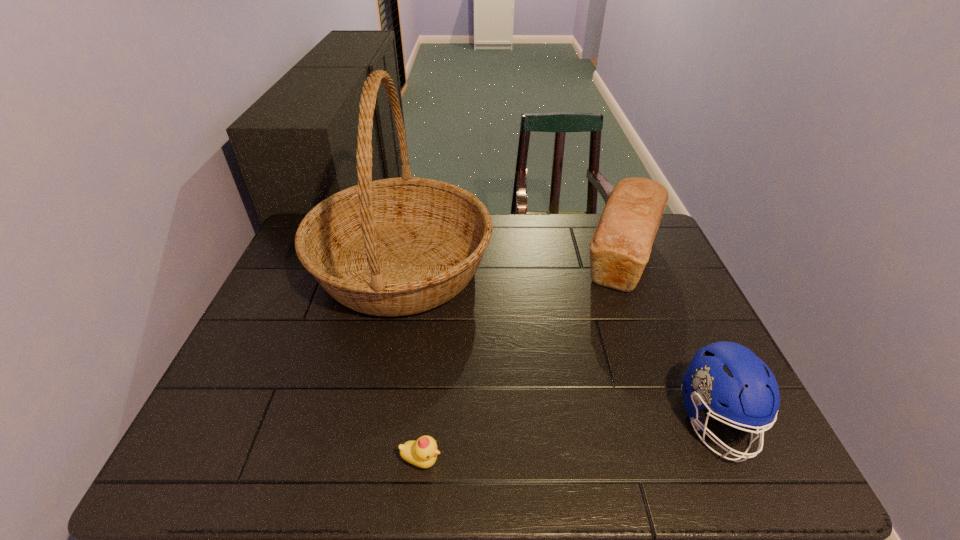
Find the location of a particular element. vacant space at the right edge of the desktop is located at coordinates (706, 342).

Locate an element on the screen. The image size is (960, 540). free space at the far left corner of the desktop is located at coordinates (297, 255).

Image resolution: width=960 pixels, height=540 pixels. I want to click on vacant space at the far right corner, so click(x=666, y=246).

Find the location of a particular element. The height and width of the screenshot is (540, 960). empty space between the third tallest object and the bread is located at coordinates (669, 340).

Find the location of a particular element. free space between the third tallest object and the bread is located at coordinates (669, 340).

You are a GUI agent. You are given a task and a screenshot of the screen. Output one action in this format:
    pyautogui.click(x=<x>, y=<y>)
    Task: Click on the empty space that is in between the bread and the shortest object
    
    Given the screenshot: What is the action you would take?
    pyautogui.click(x=521, y=360)

This screenshot has width=960, height=540. I want to click on free space that is in between the second shortest object and the tallest object, so click(559, 344).

At what (x,y) coordinates should I click in order to perform the action: click on blank region between the third shortest object and the third tallest object. Please return your answer as a coordinate pair (x, y). This screenshot has height=540, width=960. Looking at the image, I should click on (669, 340).

Identify the location of empty location between the duckling and the tallest object. The width and height of the screenshot is (960, 540). (412, 364).

This screenshot has height=540, width=960. Find the location of `empty location between the tallest object and the football helmet`. empty location between the tallest object and the football helmet is located at coordinates (559, 344).